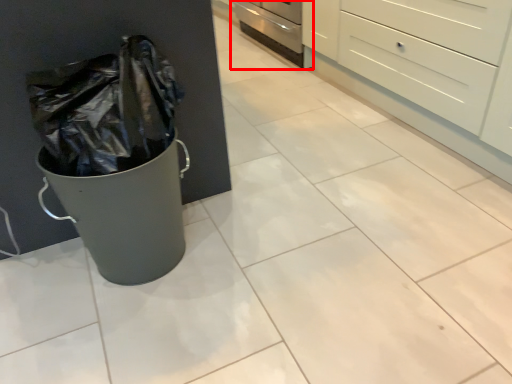
Question: From the image's perspective, what is the correct spatial positioning of oven (annotated by the red box) in reference to chest of drawers?

Choices:
 (A) above
 (B) below

Answer: (A)